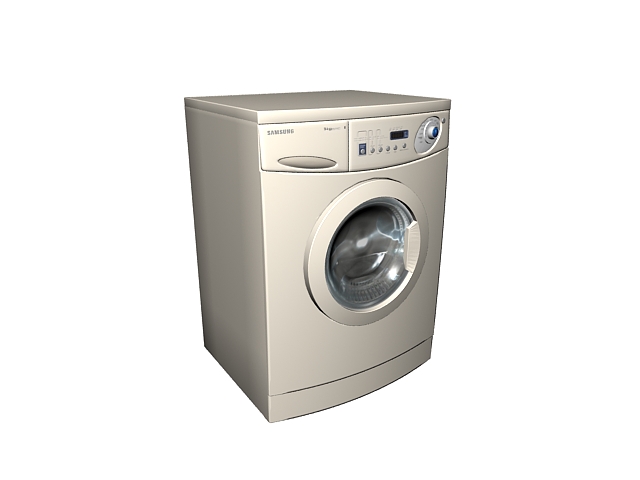
You are a GUI agent. You are given a task and a screenshot of the screen. Output one action in this format:
    pyautogui.click(x=<x>, y=<y>)
    Task: Click on the digital screen
    This screenshot has width=640, height=480.
    Given the screenshot: What is the action you would take?
    pyautogui.click(x=397, y=135)